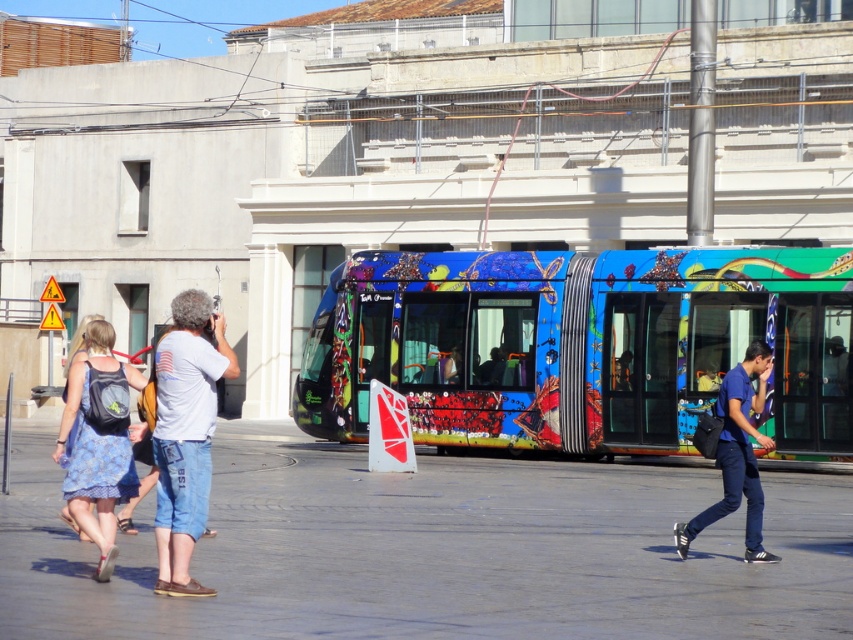
You are standing at the point with coordinates point (x=189, y=540) and want to walk towards the tram. Is the point point (x=206, y=557) in front of or behind you relative to your direction of movement?

The point (x=206, y=557) is behind point (x=189, y=540), so when you are facing towards the tram and moving forward, the point (x=206, y=557) will be behind you relative to your direction of movement.

You are a delivery person who needs to place a small package on the smooth concrete pavement at center. However, there is a white cotton shirt at center in the way. Can you place the package there without moving the shirt?

The smooth concrete pavement at center occupies less space than the white cotton shirt at center, so placing the package there might not be possible without moving the shirt since the shirt is taking up more space.

You are standing at the point with coordinates (579, 346) in the image. What object are you on?

You are on the multicolored painted bus at center.